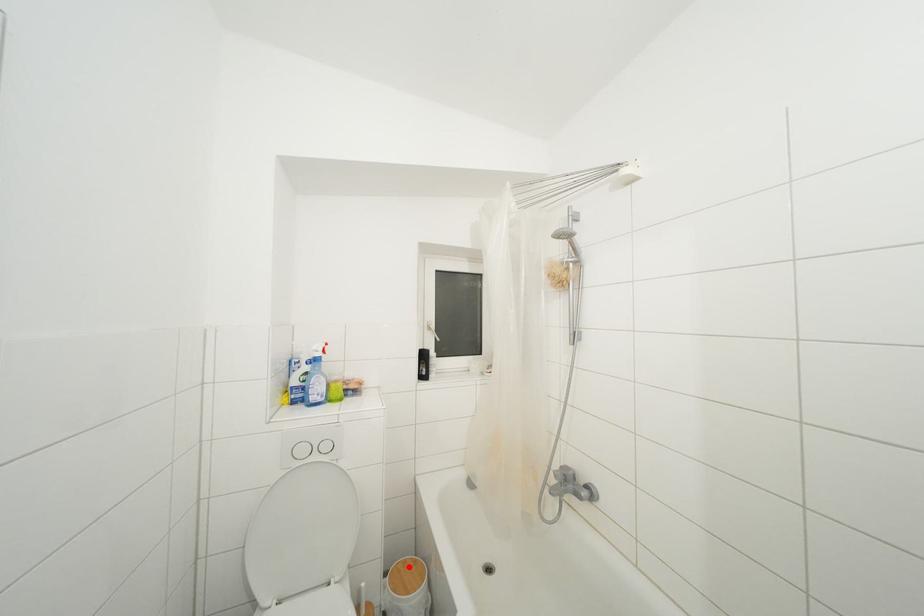
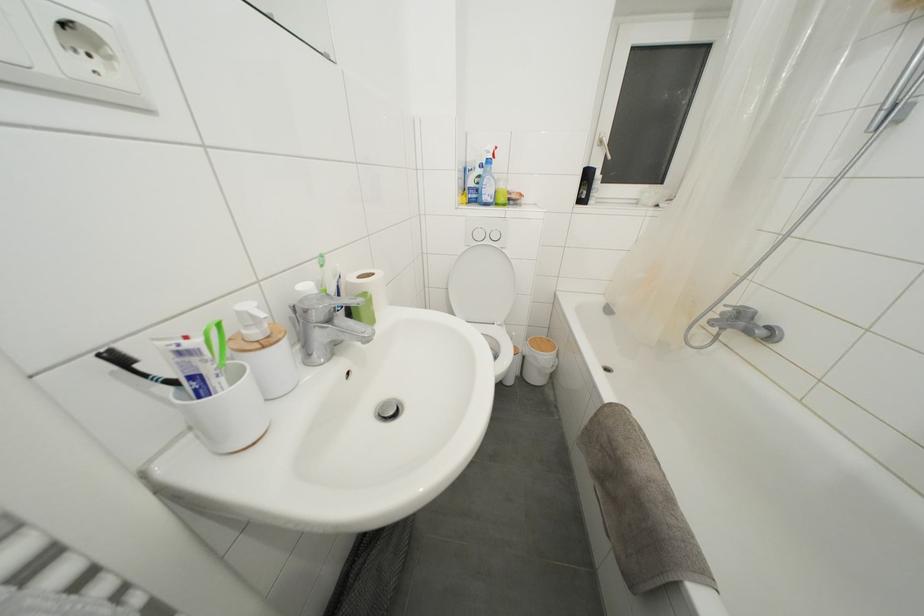
Locate, in the second image, the point that corresponds to the highlighted location in the first image.

(544, 342)